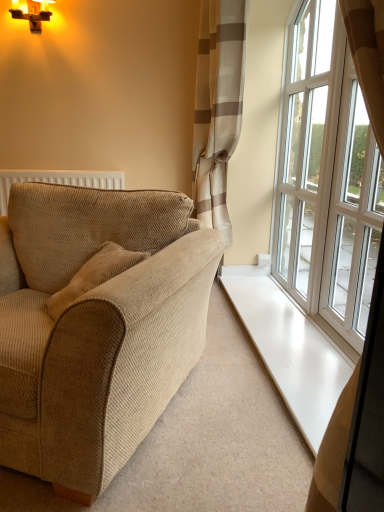
You are a GUI agent. You are given a task and a screenshot of the screen. Output one action in this format:
    pyautogui.click(x=<x>, y=<y>)
    Task: Click on the beige corduroy couch at left
    The height and width of the screenshot is (512, 384).
    Given the screenshot: What is the action you would take?
    pyautogui.click(x=96, y=326)

Find the location of `white glass window at right, positioned as the second window in back-to-front order`. white glass window at right, positioned as the second window in back-to-front order is located at coordinates (352, 218).

Is white glass window at right, acting as the 2th window starting from the front, to the right of wooden cross at upper left from the viewer's perspective?

Correct, you'll find white glass window at right, acting as the 2th window starting from the front, to the right of wooden cross at upper left.

From the image's perspective, which one is positioned higher, white glass window at right, which is counted as the 1th window, starting from the back, or wooden cross at upper left?

wooden cross at upper left is shown above in the image.

Is white glass window at right, acting as the 2th window starting from the front, bigger than wooden cross at upper left?

Yes, white glass window at right, acting as the 2th window starting from the front, is bigger than wooden cross at upper left.

Considering their positions, is white glass window at right, which is counted as the 1th window, starting from the back, located in front of or behind wooden cross at upper left?

In the image, white glass window at right, which is counted as the 1th window, starting from the back, appears in front of wooden cross at upper left.

I want to click on studio couch below the wooden cross at upper left (from the image's perspective), so click(96, 326).

From the image's perspective, is beige corduroy couch at left located above or below wooden cross at upper left?

From the image's perspective, beige corduroy couch at left appears below wooden cross at upper left.

Does beige corduroy couch at left touch wooden cross at upper left?

No, beige corduroy couch at left is not making contact with wooden cross at upper left.

Which is in front, beige corduroy couch at left or wooden cross at upper left?

beige corduroy couch at left is in front.

Is white glass window at right, which is the first window from front to back, in front of or behind white glass window at right, which is counted as the 1th window, starting from the back, in the image?

In the image, white glass window at right, which is the first window from front to back, appears in front of white glass window at right, which is counted as the 1th window, starting from the back.

Does white glass window at right, positioned as the second window in back-to-front order, have a lesser width compared to white glass window at right, which is counted as the 1th window, starting from the back?

No.

Can you see white glass window at right, positioned as the second window in back-to-front order, touching white glass window at right, acting as the 2th window starting from the front?

white glass window at right, positioned as the second window in back-to-front order, and white glass window at right, acting as the 2th window starting from the front, are not in contact.

From a real-world perspective, who is located higher, white glass window at right, positioned as the second window in back-to-front order, or white glass window at right, acting as the 2th window starting from the front?

white glass window at right, acting as the 2th window starting from the front, from a real-world perspective.

Image resolution: width=384 pixels, height=512 pixels. I want to click on light fixture behind the white glass window at right, positioned as the second window in back-to-front order, so click(33, 13).

From the image's perspective, is white glass window at right, which is the first window from front to back, above or below wooden cross at upper left?

Clearly, from the image's perspective, white glass window at right, which is the first window from front to back, is below wooden cross at upper left.

Is wooden cross at upper left surrounded by white glass window at right, positioned as the second window in back-to-front order?

No, wooden cross at upper left is not a part of white glass window at right, positioned as the second window in back-to-front order.

Considering the positions of points (323, 271) and (16, 2), is point (323, 271) closer to camera compared to point (16, 2)?

Yes, point (323, 271) is in front of point (16, 2).

Is the position of beige textured curtain at upper right less distant than that of white glass window at right, acting as the 2th window starting from the front?

No, beige textured curtain at upper right is behind white glass window at right, acting as the 2th window starting from the front.

Which of these two, beige textured curtain at upper right or white glass window at right, acting as the 2th window starting from the front, stands taller?

Standing taller between the two is beige textured curtain at upper right.

Is point (244, 63) more distant than point (318, 106)?

Yes, it is behind point (318, 106).

The width and height of the screenshot is (384, 512). Identify the location of curtain below the wooden cross at upper left (from the image's perspective). (217, 106).

Is wooden cross at upper left wider or thinner than beige textured curtain at upper right?

In the image, wooden cross at upper left appears to be more narrow than beige textured curtain at upper right.

Could beige textured curtain at upper right be considered to be inside wooden cross at upper left?

No, wooden cross at upper left does not contain beige textured curtain at upper right.

Which object is more forward, wooden cross at upper left or beige textured curtain at upper right?

beige textured curtain at upper right is in front.

From the picture: Can you tell me how much beige textured curtain at upper right and beige corduroy couch at left differ in facing direction?

63.2 degrees.

In order to click on studio couch located in front of the beige textured curtain at upper right in this screenshot , I will do `click(96, 326)`.

Can you confirm if beige textured curtain at upper right is wider than beige corduroy couch at left?

No.

Does beige textured curtain at upper right lie behind beige corduroy couch at left?

That is True.

Where is `window that is the 1st one when counting forward from the wooden cross at upper left`? Image resolution: width=384 pixels, height=512 pixels. window that is the 1st one when counting forward from the wooden cross at upper left is located at coordinates (326, 177).

Where is `studio couch that appears below the wooden cross at upper left (from a real-world perspective)`? Image resolution: width=384 pixels, height=512 pixels. studio couch that appears below the wooden cross at upper left (from a real-world perspective) is located at coordinates (96, 326).

Considering their positions, is beige corduroy couch at left positioned closer to wooden cross at upper left than white glass window at right, positioned as the second window in back-to-front order?

The object closer to wooden cross at upper left is beige corduroy couch at left.

Based on their spatial positions, is white glass window at right, which is the first window from front to back, or beige corduroy couch at left closer to wooden cross at upper left?

Based on the image, beige corduroy couch at left appears to be nearer to wooden cross at upper left.

When comparing their distances from beige textured curtain at upper right, does beige corduroy couch at left or white glass window at right, positioned as the second window in back-to-front order, seem closer?

Among the two, white glass window at right, positioned as the second window in back-to-front order, is located nearer to beige textured curtain at upper right.

When comparing their distances from white glass window at right, acting as the 2th window starting from the front, does beige corduroy couch at left or white glass window at right, positioned as the second window in back-to-front order, seem closer?

The object closer to white glass window at right, acting as the 2th window starting from the front, is white glass window at right, positioned as the second window in back-to-front order.

When comparing their distances from beige textured curtain at upper right, does wooden cross at upper left or white glass window at right, which is counted as the 1th window, starting from the back, seem closer?

white glass window at right, which is counted as the 1th window, starting from the back, is closer to beige textured curtain at upper right.

Estimate the real-world distances between objects in this image. Which object is closer to wooden cross at upper left, beige textured curtain at upper right or beige corduroy couch at left?

beige textured curtain at upper right lies closer to wooden cross at upper left than the other object.

Which object lies further to the anchor point white glass window at right, positioned as the second window in back-to-front order, wooden cross at upper left or white glass window at right, which is counted as the 1th window, starting from the back?

Based on the image, wooden cross at upper left appears to be further to white glass window at right, positioned as the second window in back-to-front order.

Looking at the image, which one is located closer to white glass window at right, positioned as the second window in back-to-front order, white glass window at right, acting as the 2th window starting from the front, or beige textured curtain at upper right?

Based on the image, white glass window at right, acting as the 2th window starting from the front, appears to be nearer to white glass window at right, positioned as the second window in back-to-front order.

The width and height of the screenshot is (384, 512). Find the location of `window between beige corduroy couch at left and white glass window at right, which is the first window from front to back`. window between beige corduroy couch at left and white glass window at right, which is the first window from front to back is located at coordinates (326, 177).

Where is `window located between white glass window at right, which is the first window from front to back, and beige textured curtain at upper right in the depth direction`? The width and height of the screenshot is (384, 512). window located between white glass window at right, which is the first window from front to back, and beige textured curtain at upper right in the depth direction is located at coordinates (326, 177).

The image size is (384, 512). Find the location of `studio couch between wooden cross at upper left and white glass window at right, which is the first window from front to back, from left to right`. studio couch between wooden cross at upper left and white glass window at right, which is the first window from front to back, from left to right is located at coordinates (96, 326).

Locate an element on the screen. The image size is (384, 512). studio couch between wooden cross at upper left and white glass window at right, acting as the 2th window starting from the front, in the horizontal direction is located at coordinates (96, 326).